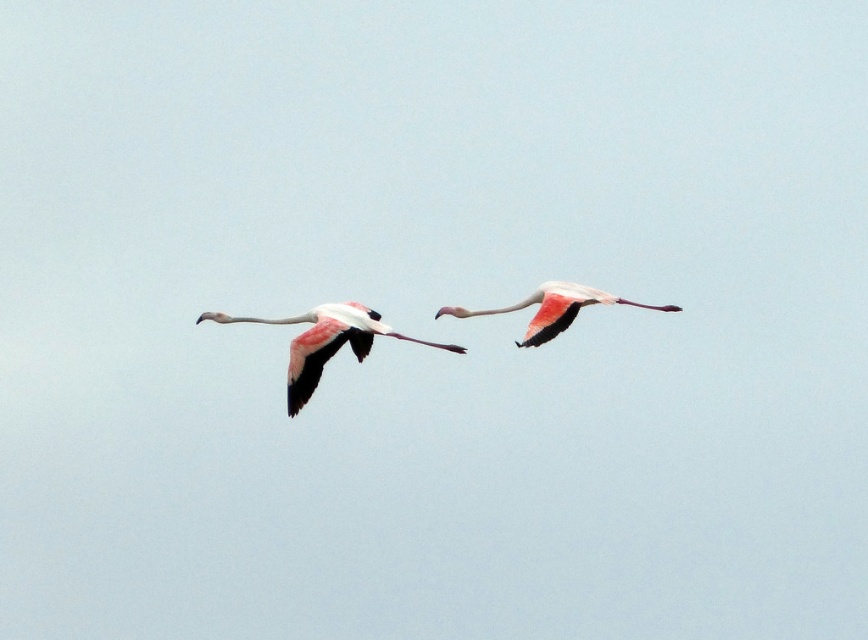
Question: Where is pink feathered flamingo at center located in relation to pink matte flamingo at center in the image?

Choices:
 (A) above
 (B) below

Answer: (B)

Question: Observing the image, what is the correct spatial positioning of pink feathered flamingo at center in reference to pink matte flamingo at center?

Choices:
 (A) left
 (B) right

Answer: (A)

Question: Is pink feathered flamingo at center further to the viewer compared to pink matte flamingo at center?

Choices:
 (A) yes
 (B) no

Answer: (B)

Question: Among these points, which one is farthest from the camera?

Choices:
 (A) (301, 403)
 (B) (599, 292)

Answer: (B)